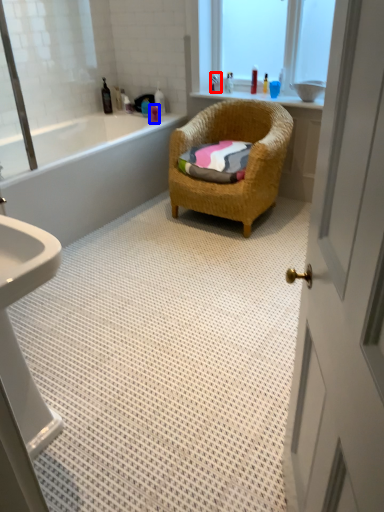
Question: Which point is closer to the camera, toiletry (highlighted by a red box) or toiletry (highlighted by a blue box)?

Choices:
 (A) toiletry
 (B) toiletry

Answer: (B)